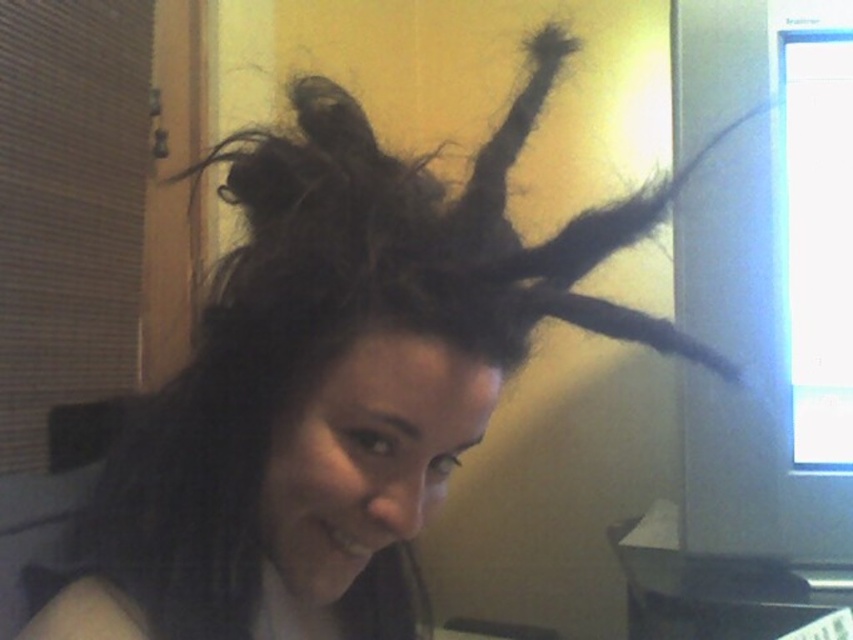
Question: Which object appears farthest from the camera in this image?

Choices:
 (A) dark fuzzy hair at center
 (B) matte black monitor at right
 (C) metallic gray computer desk at lower right

Answer: (B)

Question: Which point is closer to the camera?

Choices:
 (A) (328, 113)
 (B) (680, 218)

Answer: (A)

Question: Which point is farther to the camera?

Choices:
 (A) matte black monitor at right
 (B) dark fuzzy hair at center

Answer: (A)

Question: Can you confirm if dark fuzzy hair at center is wider than metallic gray computer desk at lower right?

Choices:
 (A) no
 (B) yes

Answer: (B)

Question: Does dark fuzzy hair at center have a larger size compared to matte black monitor at right?

Choices:
 (A) no
 (B) yes

Answer: (B)

Question: Is dark fuzzy hair at center wider than metallic gray computer desk at lower right?

Choices:
 (A) yes
 (B) no

Answer: (A)